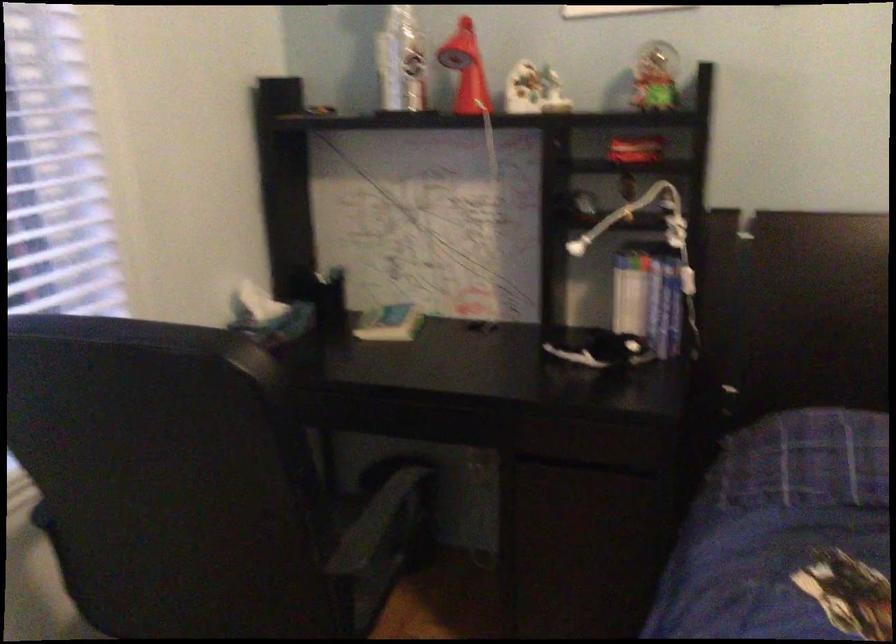
Where would you adjust the red lamp head? Please return your answer as a coordinate pair (x, y).

(466, 69)